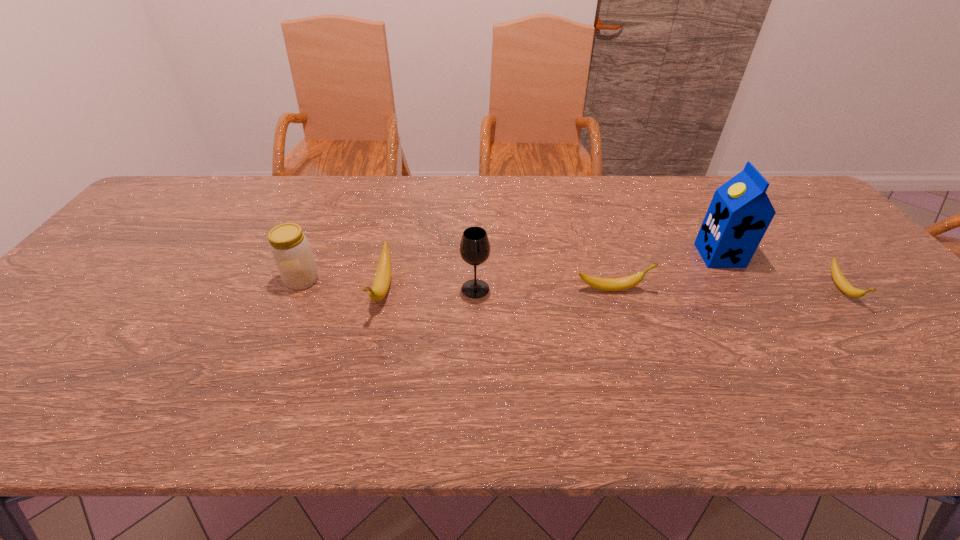
In order to click on free point between the tallest object and the third object from right to left in this screenshot , I will do `click(665, 272)`.

The image size is (960, 540). What are the coordinates of `free space that is in between the jar and the second object from left to right` in the screenshot? It's located at (343, 285).

At what (x,y) coordinates should I click in order to perform the action: click on object that can be found as the fourth closest to the wineglass. Please return your answer as a coordinate pair (x, y). The width and height of the screenshot is (960, 540). Looking at the image, I should click on (740, 212).

I want to click on object that is the closest to the leftmost object, so click(382, 279).

Select which banana appears as the second closest to the rightmost banana. Please provide its 2D coordinates. Your answer should be formatted as a tuple, i.e. [(x, y)], where the tuple contains the x and y coordinates of a point satisfying the conditions above.

[(382, 279)]

Point out which banana is positioned as the second nearest to the rightmost banana. Please provide its 2D coordinates. Your answer should be formatted as a tuple, i.e. [(x, y)], where the tuple contains the x and y coordinates of a point satisfying the conditions above.

[(382, 279)]

You are a GUI agent. You are given a task and a screenshot of the screen. Output one action in this format:
    pyautogui.click(x=<x>, y=<y>)
    Task: Click on the vacant space that satisfies the following two spatial constraints: 1. with the cap open on the second object from right to left; 2. on the front side of the jar
    The image size is (960, 540).
    Given the screenshot: What is the action you would take?
    pyautogui.click(x=734, y=280)

At what (x,y) coordinates should I click in order to perform the action: click on vacant area in the image that satisfies the following two spatial constraints: 1. with the cap open on the second object from right to left; 2. at the stem of the second object from left to right. Please return your answer as a coordinate pair (x, y). The height and width of the screenshot is (540, 960). Looking at the image, I should click on (740, 289).